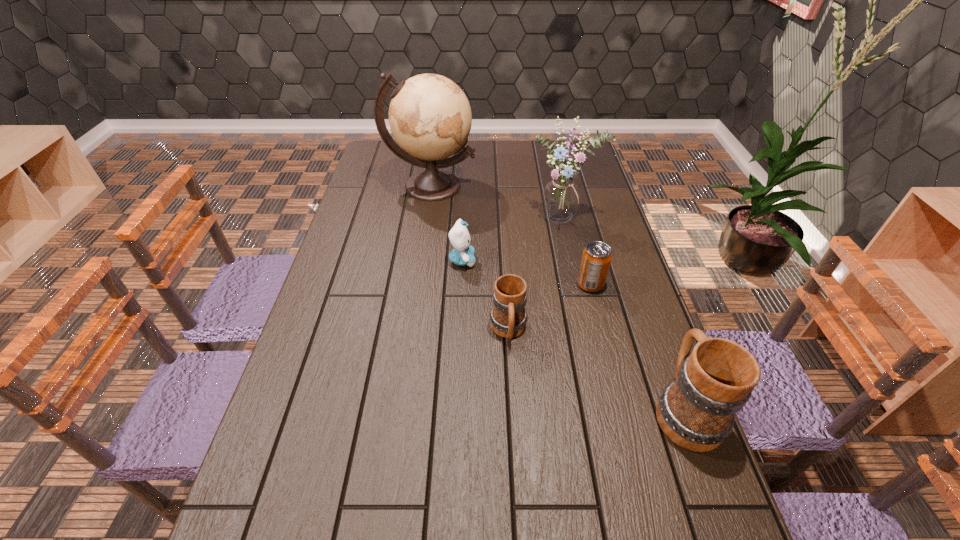
Image resolution: width=960 pixels, height=540 pixels. Find the location of `vacant region that satisfies the following two spatial constraints: 1. on the face of the kitten; 2. on the side of the nearest object with the handle`. vacant region that satisfies the following two spatial constraints: 1. on the face of the kitten; 2. on the side of the nearest object with the handle is located at coordinates (456, 409).